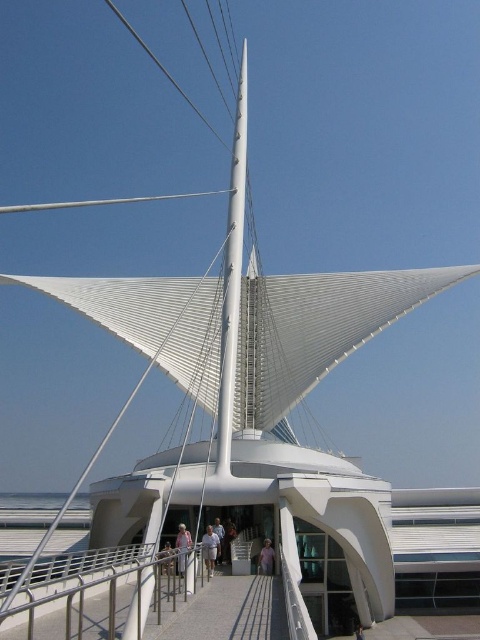
Measure the distance from white fabric at center to light skin tone person at center.

white fabric at center and light skin tone person at center are 3.24 meters apart.

Who is higher up, white fabric at center or light skin tone person at center?

Positioned higher is white fabric at center.

Find the location of a particular element. Image resolution: width=480 pixels, height=640 pixels. white fabric at center is located at coordinates (182, 538).

Between satin silver railing at lower center and light brown wooden handrail at center, which one is positioned lower?

light brown wooden handrail at center is lower down.

Is satin silver railing at lower center positioned in front of light brown wooden handrail at center?

Yes.

Which is in front, point (129, 618) or point (261, 572)?

Positioned in front is point (129, 618).

Locate an element on the screen. The image size is (480, 640). satin silver railing at lower center is located at coordinates (106, 600).

Is gray concrete path at center thinner than light skin tone person at center?

In fact, gray concrete path at center might be wider than light skin tone person at center.

Between point (218, 634) and point (169, 548), which one is positioned in front?

Point (218, 634)

The image size is (480, 640). What do you see at coordinates (228, 611) in the screenshot? I see `gray concrete path at center` at bounding box center [228, 611].

Where is `gray concrete path at center`? gray concrete path at center is located at coordinates (228, 611).